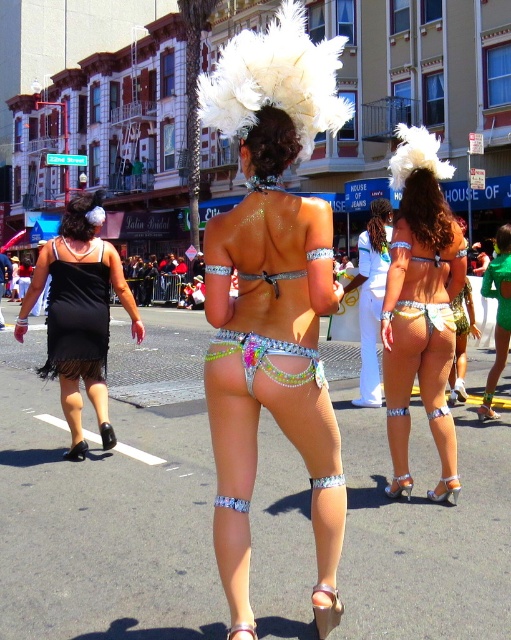
Question: Which object is farther from the camera taking this photo?

Choices:
 (A) shiny metallic sandal at lower center
 (B) neon green fabric bikini at center
 (C) black satin dress at left
 (D) shiny orange leather sandal at lower center

Answer: (B)

Question: Among these points, which one is farthest from the camera?

Choices:
 (A) (244, 632)
 (B) (112, 445)
 (C) (43, 282)

Answer: (B)

Question: Where is glittery sequined bikini at center located in relation to multicolored sequined bikini bottom at center in the image?

Choices:
 (A) left
 (B) right

Answer: (B)

Question: Can you confirm if shiny silver bikini at center is smaller than shiny orange leather sandal at lower center?

Choices:
 (A) no
 (B) yes

Answer: (A)

Question: Is fishnet bikini at center bigger than multicolored sequined bikini bottom at center?

Choices:
 (A) yes
 (B) no

Answer: (A)

Question: Which point appears closest to the camera in this image?

Choices:
 (A) (105, 449)
 (B) (66, 253)

Answer: (B)